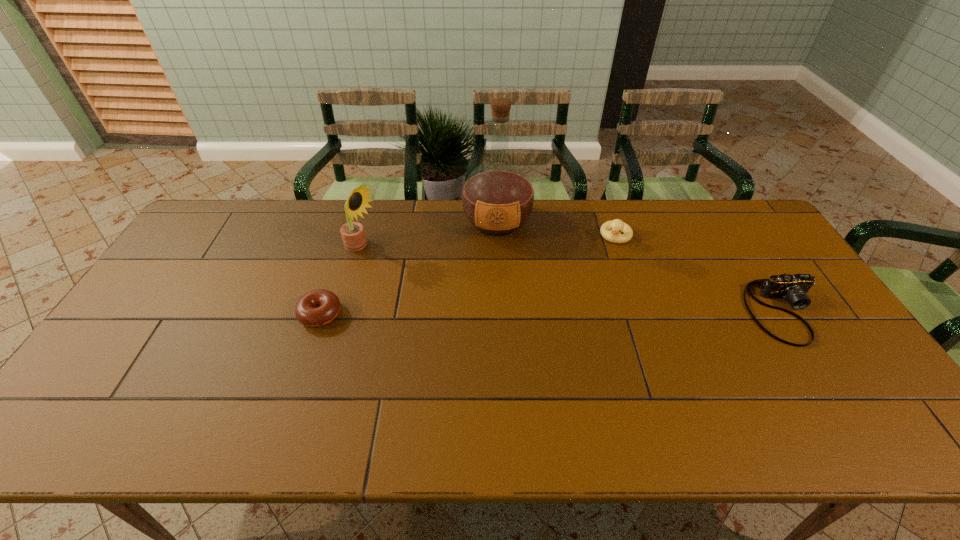
The height and width of the screenshot is (540, 960). I want to click on free location located 0.140m at the beak of the duckling, so click(600, 273).

Locate an element on the screen. This screenshot has width=960, height=540. blank space located 0.400m at the beak of the duckling is located at coordinates (572, 334).

Where is `vacant region located 0.090m on the front label of the third object from right to left`? vacant region located 0.090m on the front label of the third object from right to left is located at coordinates (496, 264).

I want to click on vacant point located on the front label of the third object from right to left, so click(496, 266).

Locate an element on the screen. The width and height of the screenshot is (960, 540). free space located 0.210m on the front label of the third object from right to left is located at coordinates (495, 292).

Find the location of `free space located on the face of the second tallest object`. free space located on the face of the second tallest object is located at coordinates (403, 267).

Find the location of a particular element. Image resolution: width=960 pixels, height=540 pixels. vacant space located on the face of the second tallest object is located at coordinates (397, 264).

Locate an element on the screen. vacant region located 0.290m on the face of the second tallest object is located at coordinates (455, 289).

The height and width of the screenshot is (540, 960). In order to click on duckling that is at the far edge in this screenshot , I will do `click(616, 226)`.

This screenshot has height=540, width=960. What are the coordinates of `liquor present at the far edge` in the screenshot? It's located at (497, 198).